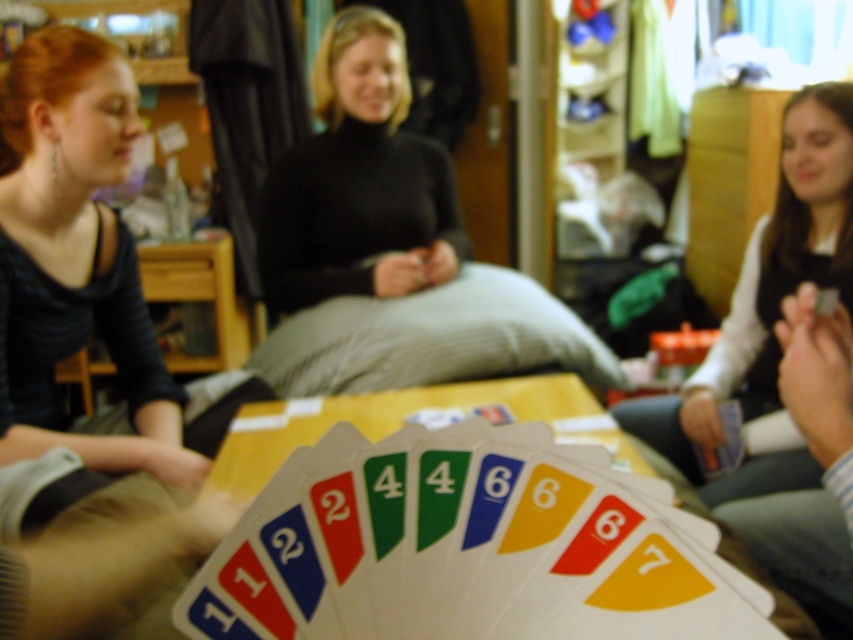
You are a photographer taking a picture of the matte black shirt at left and the smooth black card at right. Based on their positions, which object will appear larger in the photo?

The matte black shirt at left is closer to the viewer than the smooth black card at right, so it will appear larger in the photo.

You are a photographer trying to capture a closeup of the smooth black card at right while ensuring the matte black shirt at left is still visible in the frame. Given their heights, will you need to adjust your camera angle upwards or downwards to include both?

The matte black shirt at left is not as tall as the smooth black card at right. To include both in the frame, you should adjust your camera angle downwards since the smooth black card at right is taller than the matte black shirt at left.